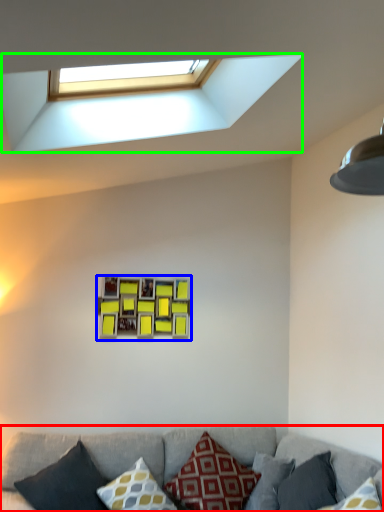
Question: Estimate the real-world distances between objects in this image. Which object is closer to studio couch (highlighted by a red box), picture frame (highlighted by a blue box) or window (highlighted by a green box)?

Choices:
 (A) picture frame
 (B) window

Answer: (A)